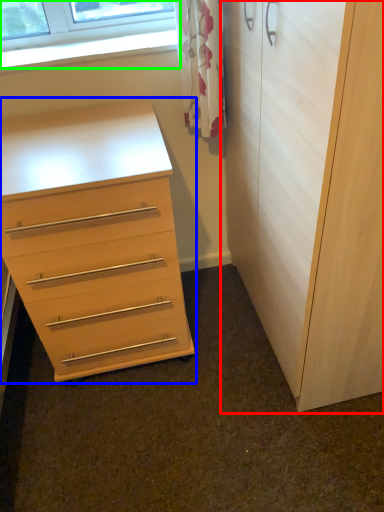
Question: Based on their relative distances, which object is nearer to cupboard (highlighted by a red box)? Choose from chest of drawers (highlighted by a blue box) and window (highlighted by a green box).

Choices:
 (A) chest of drawers
 (B) window

Answer: (A)